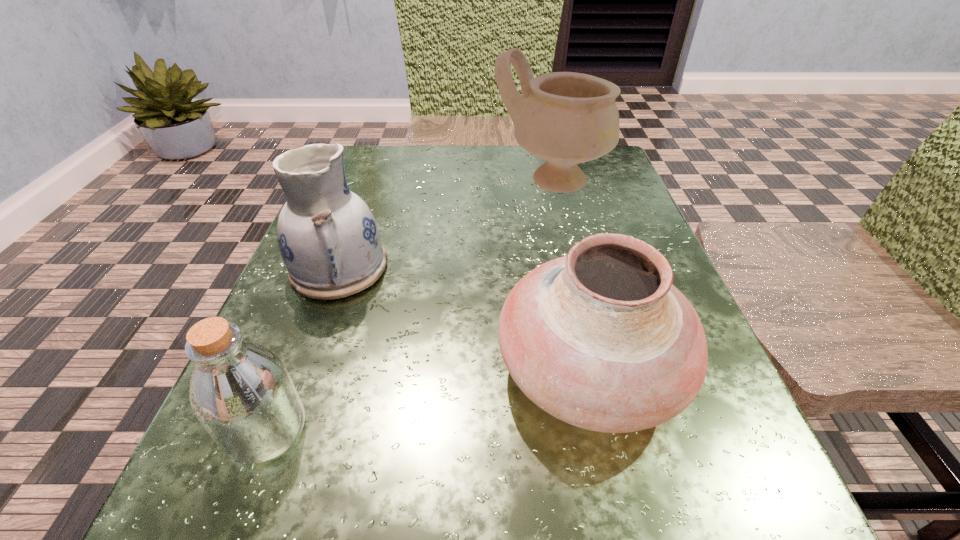
You are a GUI agent. You are given a task and a screenshot of the screen. Output one action in this format:
    pyautogui.click(x=<x>, y=<y>)
    Task: Click on the empty space that is in between the bottle and the second nearest pottery
    
    Given the screenshot: What is the action you would take?
    pyautogui.click(x=303, y=348)

The width and height of the screenshot is (960, 540). I want to click on empty space between the bottle and the farthest pottery, so click(408, 305).

What are the coordinates of `free space between the leftmost pottery and the nearest pottery` in the screenshot? It's located at click(465, 319).

What are the coordinates of `free space between the leftmost pottery and the bottle` in the screenshot? It's located at (303, 348).

You are a GUI agent. You are given a task and a screenshot of the screen. Output one action in this format:
    pyautogui.click(x=<x>, y=<y>)
    Task: Click on the free space between the nearest pottery and the second nearest pottery
    
    Given the screenshot: What is the action you would take?
    pyautogui.click(x=465, y=319)

Image resolution: width=960 pixels, height=540 pixels. Identify the location of empty space between the bottle and the third nearest object. (303, 348).

This screenshot has height=540, width=960. I want to click on object that is the third closest to the leftmost pottery, so click(567, 118).

The width and height of the screenshot is (960, 540). In order to click on object that stands as the third closest to the leftmost pottery in this screenshot , I will do `click(567, 118)`.

At what (x,y) coordinates should I click in order to perform the action: click on pottery object that ranks as the second closest to the farthest object. Please return your answer as a coordinate pair (x, y). Looking at the image, I should click on (601, 339).

Point out which pottery is positioned as the nearest to the second farthest object. Please provide its 2D coordinates. Your answer should be formatted as a tuple, i.e. [(x, y)], where the tuple contains the x and y coordinates of a point satisfying the conditions above.

[(601, 339)]